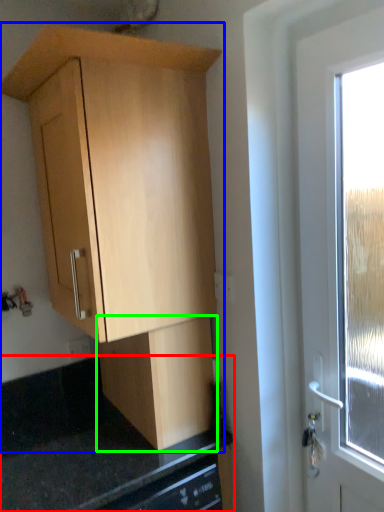
Question: Which is nearer to the counter top (highlighted by a red box)? cabinetry (highlighted by a blue box) or cabinetry (highlighted by a green box).

Choices:
 (A) cabinetry
 (B) cabinetry

Answer: (B)